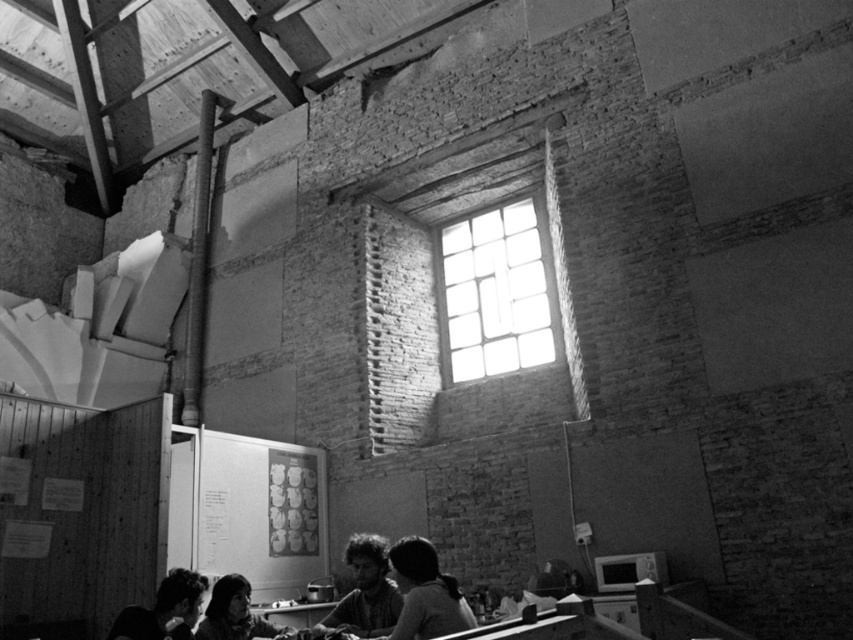
You are standing in the workspace and want to find the smooth black hair at lower center. Based on the coordinates provided in the Objects Description, can you determine its position relative to the large window?

The smooth black hair at lower center is located at point 0.928 on the x axis and 0.499 on the y axis. Since the large window is near the center of the back wall, the smooth black hair at lower center is positioned to the right and slightly below the window.

You are standing in the room and want to locate the point at coordinates (364, 589). Based on the scene description, where would this point be located?

The point at coordinates (364, 589) is on dark hair at center.

You are standing in the room and see two people with smooth black hair at lower center and smooth black hair at lower left. Which person is closer to you?

The smooth black hair at lower center is closer to the viewer than the smooth black hair at lower left.